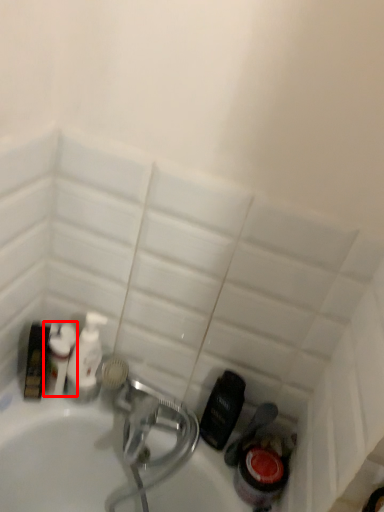
Question: In this image, where is cleaning product (annotated by the red box) located relative to cleaning product?

Choices:
 (A) right
 (B) left

Answer: (B)